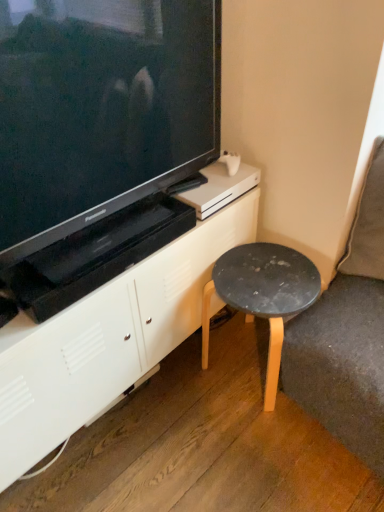
Question: Would you say matte black television at upper left is to the left or to the right of white matte cabinet at center in the picture?

Choices:
 (A) left
 (B) right

Answer: (B)

Question: Is point (155, 41) positioned closer to the camera than point (38, 402)?

Choices:
 (A) farther
 (B) closer

Answer: (A)

Question: Based on their relative distances, which object is nearer to the matte black television at upper left?

Choices:
 (A) black matte stool at lower right
 (B) white matte cabinet at center

Answer: (B)

Question: Considering the real-world distances, which object is farthest from the matte black television at upper left?

Choices:
 (A) white matte cabinet at center
 (B) black matte stool at lower right

Answer: (B)